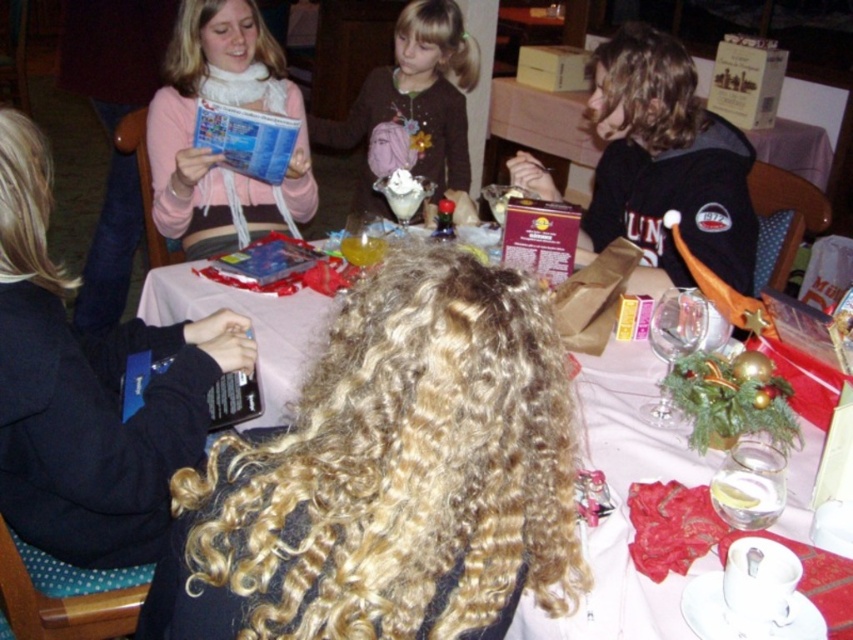
You are trying to decide which item to grab first from the table. The matte pink scarf at upper left and the brown cotton shirt at upper center are both within reach. Based on their heights, which one can you pick up without bending down further?

The matte pink scarf at upper left has a lesser height compared to the brown cotton shirt at upper center, so you can pick up the matte pink scarf at upper left without bending down as much.

You are sitting at the smooth white table at center and want to pass a napkin to the person with dark brown hair at right. Can you reach them directly without getting up?

The smooth white table at center is closer to the viewer than dark brown hair at right, so you would need to reach across the table or have someone else pass it since the distance might be too far while seated.